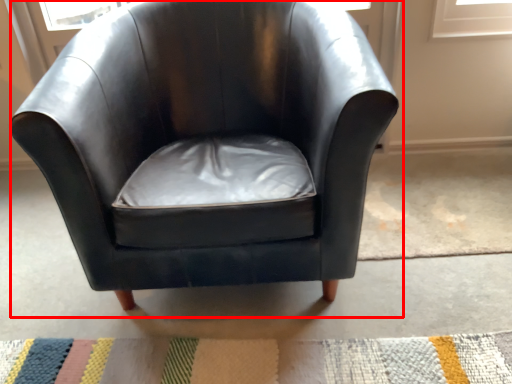
Question: From the image's perspective, what is the correct spatial positioning of chair (annotated by the red box) in reference to doormat?

Choices:
 (A) above
 (B) below

Answer: (A)